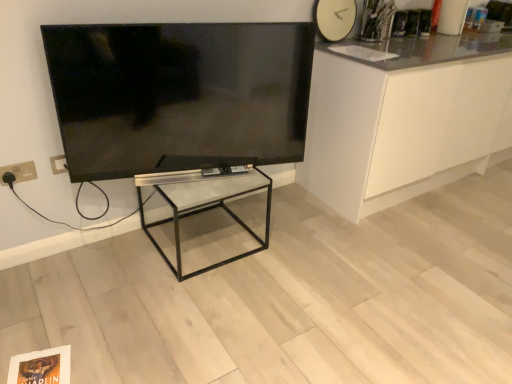
Question: From the image's perspective, is clear glass table at center above or below white glossy cabinet at right?

Choices:
 (A) below
 (B) above

Answer: (A)

Question: Looking at the image, does clear glass table at center seem bigger or smaller compared to white glossy cabinet at right?

Choices:
 (A) big
 (B) small

Answer: (B)

Question: Which of these objects is positioned farthest from the white glossy cabinet at right?

Choices:
 (A) flat screen tv at upper left
 (B) gold metallic electric outlet at lower left
 (C) white matte clock at upper right
 (D) clear glass table at center

Answer: (B)

Question: Which object is positioned closest to the white glossy cabinet at right?

Choices:
 (A) white matte clock at upper right
 (B) gold metallic electric outlet at lower left
 (C) clear glass table at center
 (D) flat screen tv at upper left

Answer: (A)